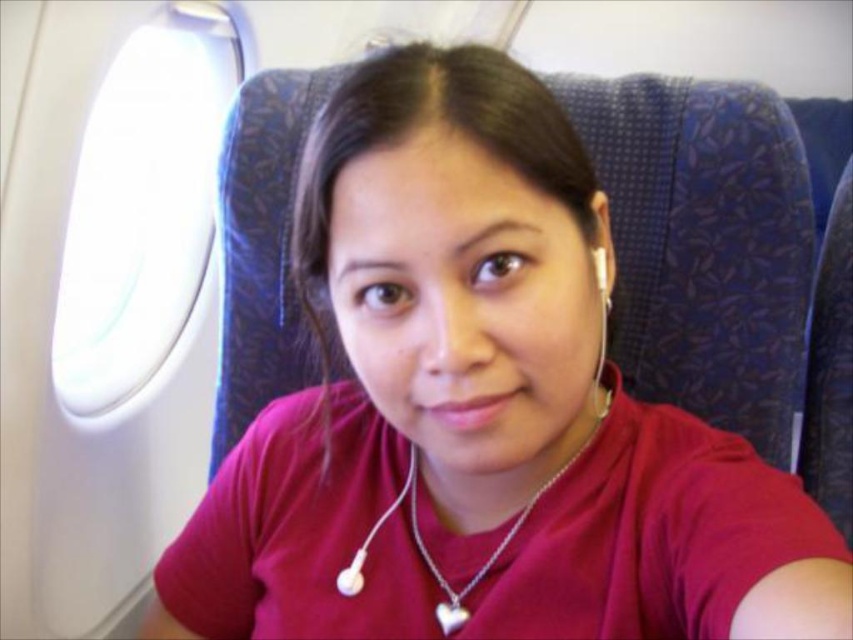
You are a flight attendant checking the cabin. You notice the transparent plastic airplane window at upper left and the white earbud at center. Which object is bigger in size?

The transparent plastic airplane window at upper left has a larger size compared to the white earbud at center.